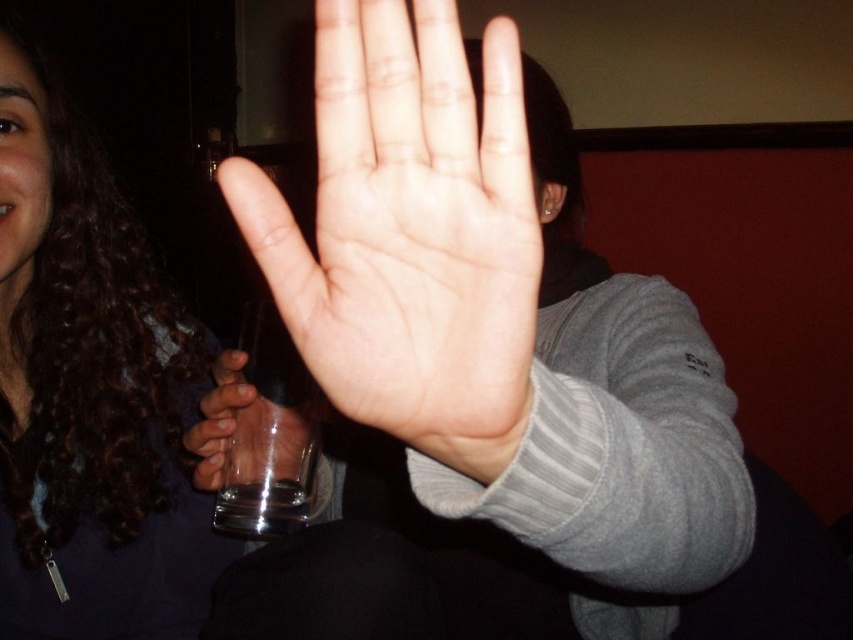
Question: Estimate the real-world distances between objects in this image. Which object is closer to the pale skin palm at center?

Choices:
 (A) dark curly hair at upper left
 (B) smooth skin hand at center

Answer: (B)

Question: Is pale skin palm at center bigger than transparent glass at center?

Choices:
 (A) no
 (B) yes

Answer: (A)

Question: Which object is the closest to the smooth skin hand at center?

Choices:
 (A) transparent glass at center
 (B) pale skin palm at center

Answer: (B)

Question: Among these objects, which one is farthest from the camera?

Choices:
 (A) dark curly hair at upper left
 (B) transparent glass at center
 (C) pale skin palm at center

Answer: (A)

Question: Where is pale skin palm at center located in relation to transparent glass at center in the image?

Choices:
 (A) right
 (B) left

Answer: (A)

Question: Does dark curly hair at upper left have a greater width compared to transparent glass at center?

Choices:
 (A) no
 (B) yes

Answer: (B)